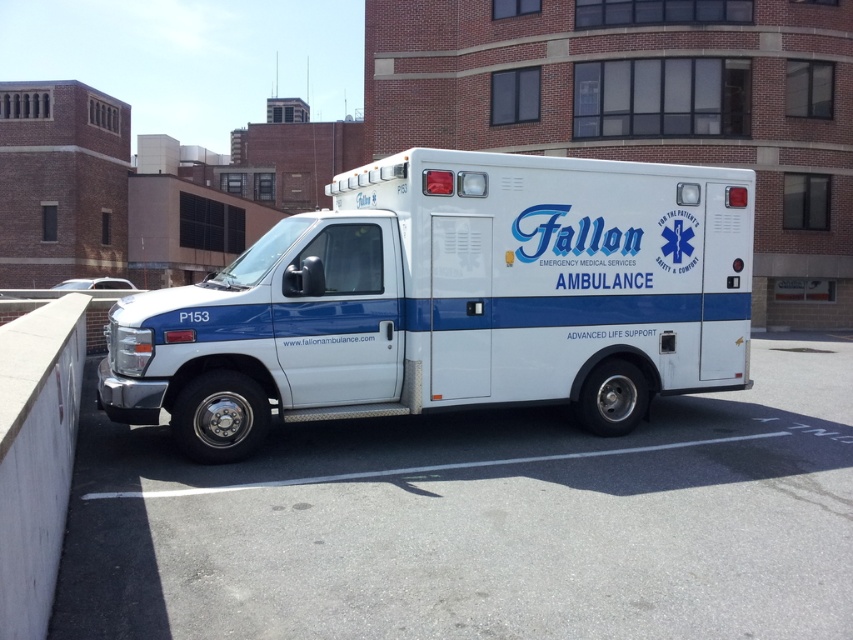
Who is positioned more to the left, white smooth asphalt at center or white glossy ambulance at center?

white glossy ambulance at center

Does white smooth asphalt at center have a greater width compared to white glossy ambulance at center?

No.

Between point (193, 604) and point (352, 262), which one is positioned in front?

Positioned in front is point (193, 604).

The image size is (853, 640). Identify the location of white smooth asphalt at center. (480, 522).